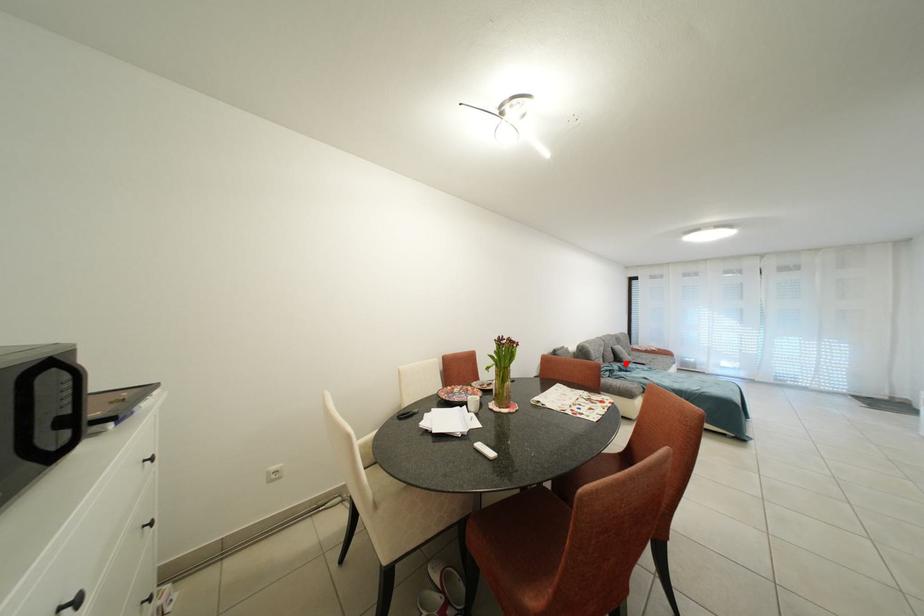
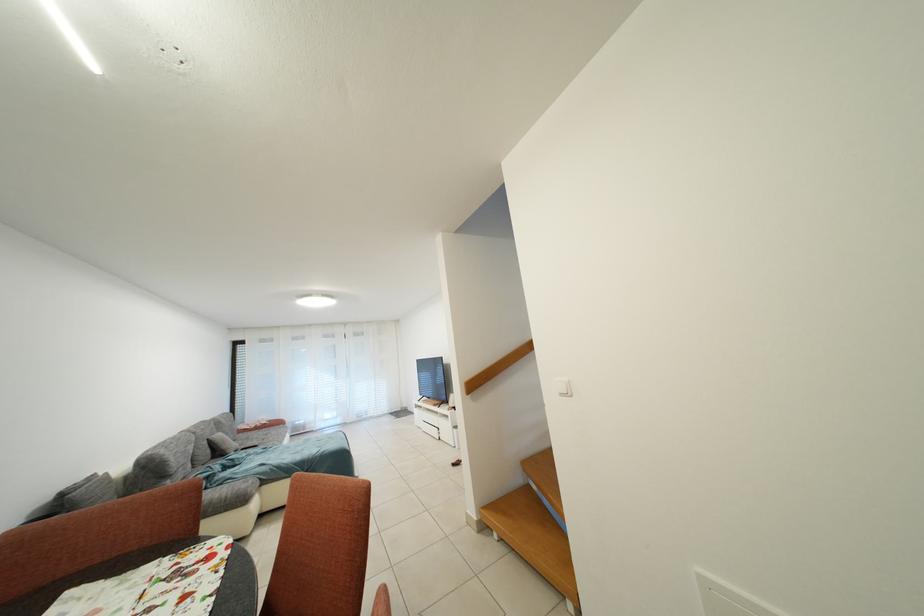
Question: I am providing you with two images of the same scene from different viewpoints. Image1 has a red point marked. In image2, the corresponding 3D location appears at what relative position? Reply with the corresponding letter.

Choices:
 (A) Closer
 (B) Farther

Answer: (A)